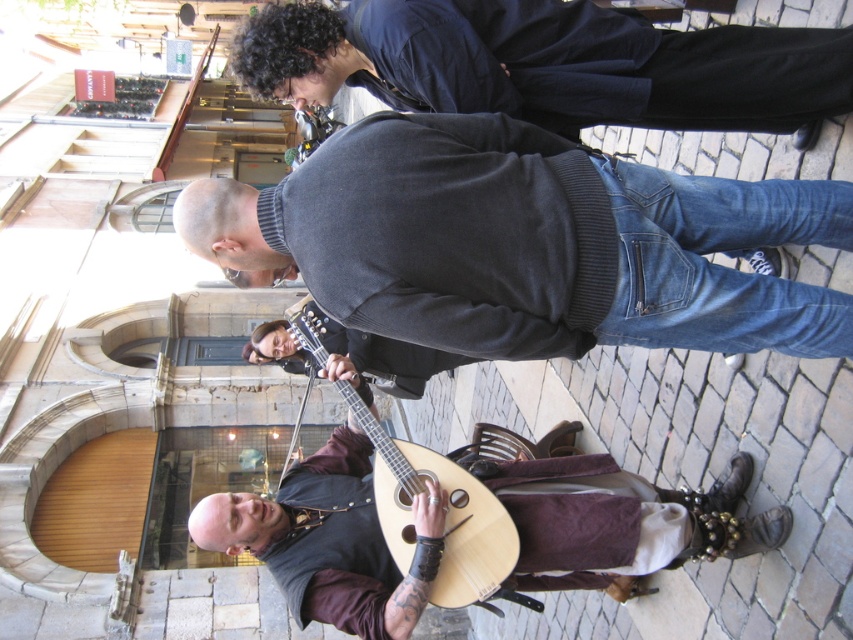
You are a photographer trying to capture a closeup of the dark blue sweater at center and the wooden acoustic guitar at center. Since your camera can only focus on one object at a time, which object should you focus on first if you want to ensure the larger object is in focus?

The dark blue sweater at center is wider than the wooden acoustic guitar at center, so you should focus on the dark blue sweater at center first to ensure the larger object is in focus.

You are a photographer trying to capture a photo of the dark blue sweater at center and the wooden acoustic guitar at center. Since you want both objects in the frame, which one should you position your camera closer to if you want the other object to appear larger in the photo?

To make the wooden acoustic guitar at center appear larger in the photo, you should position your camera closer to the dark blue sweater at center. Since the dark blue sweater at center is to the right of the wooden acoustic guitar at center, moving closer to the sweater would bring the guitar into a position where it occupies more of the frame.